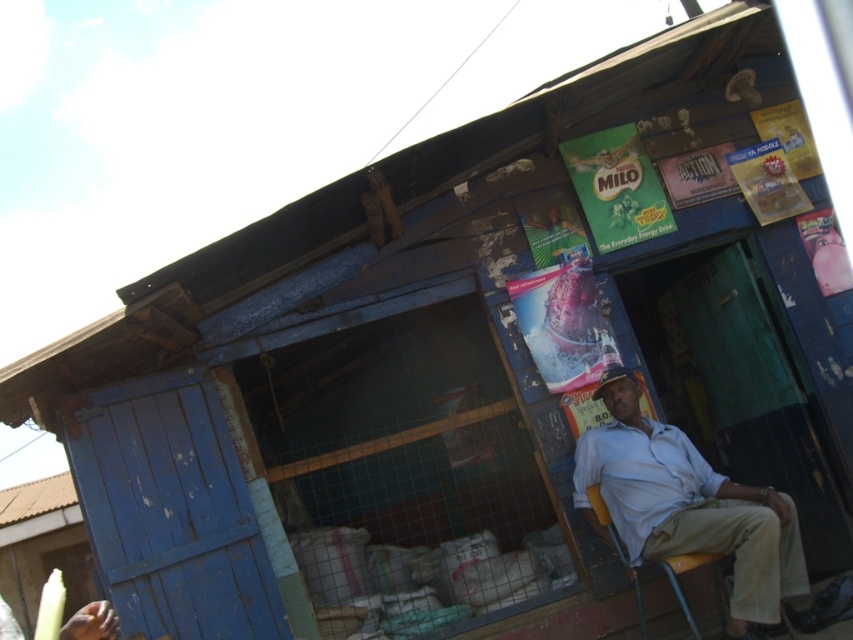
Locate an element on the screen. The height and width of the screenshot is (640, 853). light blue shirt at center is located at coordinates (688, 506).

Who is higher up, light blue shirt at center or yellow plastic chair at lower right?

Positioned higher is light blue shirt at center.

Between point (778, 518) and point (717, 582), which one is positioned in front?

Point (778, 518)

The height and width of the screenshot is (640, 853). I want to click on light blue shirt at center, so (688, 506).